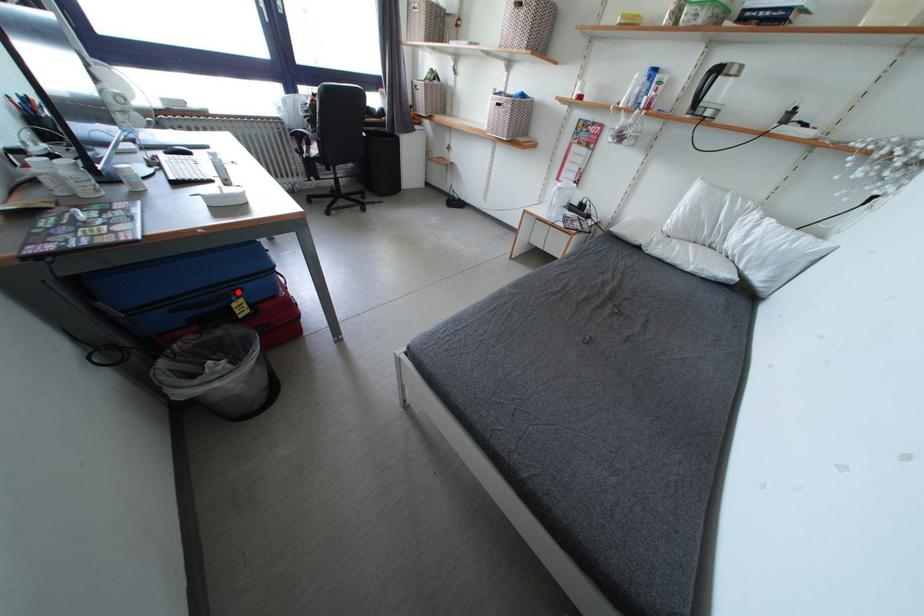
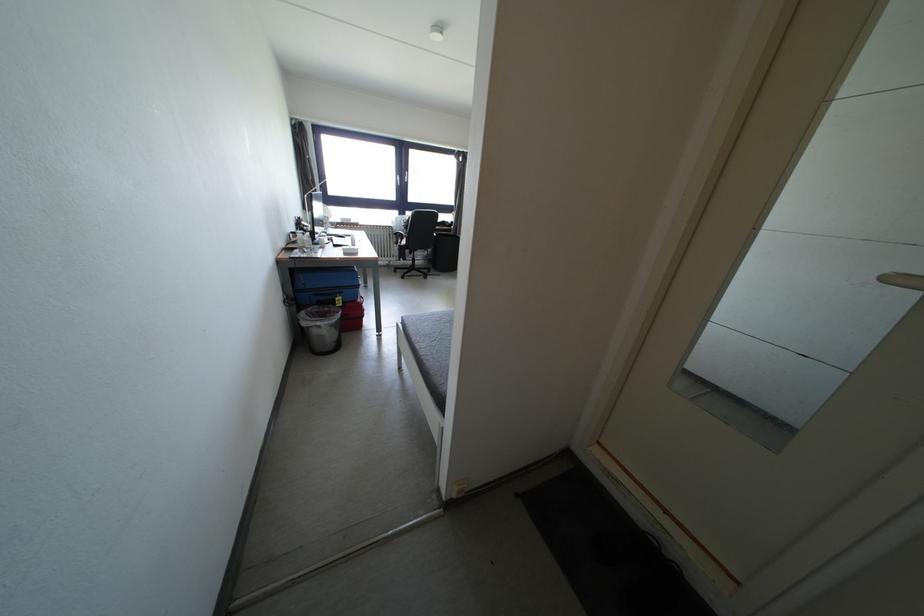
Question: I am providing you with two images of the same scene from different viewpoints. A red point is shown in image1. For the corresponding object point in image2, is it positioned nearer or farther from the camera?

Choices:
 (A) Nearer
 (B) Farther

Answer: (A)